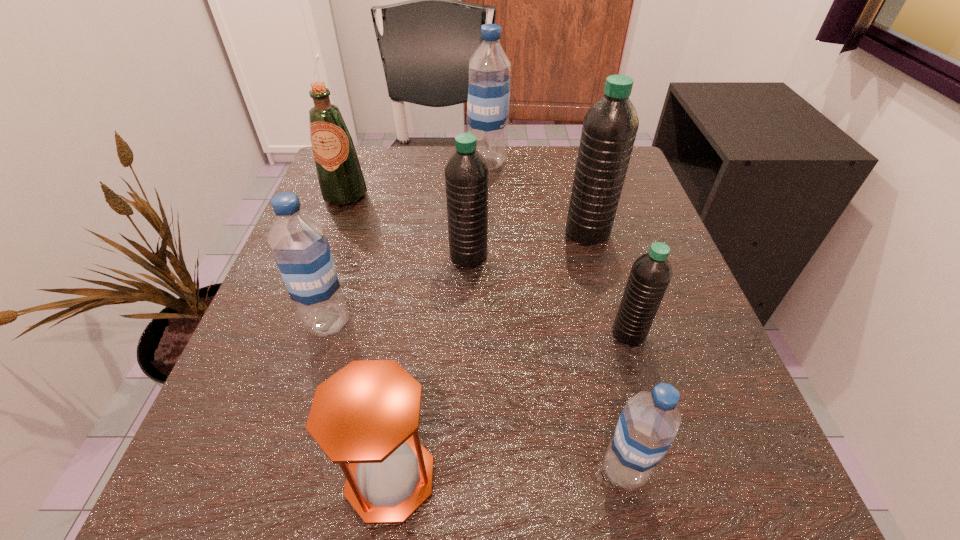
Locate an element on the screen. The height and width of the screenshot is (540, 960). water bottle that is the fourth closest one to the smallest blue water bottle is located at coordinates (298, 242).

Where is `the fourth closest water bottle to the green olive oil`? Image resolution: width=960 pixels, height=540 pixels. the fourth closest water bottle to the green olive oil is located at coordinates (609, 129).

Find the location of a particular element. This screenshot has width=960, height=540. the third closest blue water bottle to the leftmost black water bottle is located at coordinates (648, 424).

In order to click on blue water bottle that is the third closest to the biggest black water bottle in this screenshot , I will do `click(298, 242)`.

Identify the location of black water bottle that can be found as the third closest to the nearest water bottle. This screenshot has height=540, width=960. (609, 129).

You are a GUI agent. You are given a task and a screenshot of the screen. Output one action in this format:
    pyautogui.click(x=<x>, y=<y>)
    Task: Click on the black water bottle that is the third closest one to the nearest water bottle
    
    Given the screenshot: What is the action you would take?
    pyautogui.click(x=609, y=129)

Find the location of a particular element. vacant space that satisfies the following two spatial constraints: 1. on the front-facing side of the leftmost black water bottle; 2. on the right side of the green olive oil is located at coordinates (322, 256).

I want to click on vacant point that satisfies the following two spatial constraints: 1. on the label of the nearest black water bottle; 2. on the left side of the leftmost water bottle, so click(x=324, y=334).

At what (x,y) coordinates should I click in order to perform the action: click on vacant space that satisfies the following two spatial constraints: 1. on the back side of the third object from left to right; 2. on the left side of the biggest black water bottle. Please return your answer as a coordinate pair (x, y). This screenshot has height=540, width=960. Looking at the image, I should click on (424, 233).

Image resolution: width=960 pixels, height=540 pixels. I want to click on free spot that satisfies the following two spatial constraints: 1. on the front-facing side of the olive oil; 2. on the left side of the third object from left to right, so click(x=239, y=477).